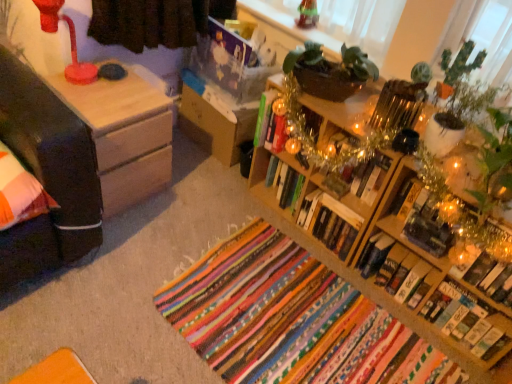
Question: Is multicolored woven rug at center wider than wooden bookshelf at right?

Choices:
 (A) yes
 (B) no

Answer: (A)

Question: From a real-world perspective, does multicolored woven rug at center stand above wooden bookshelf at right?

Choices:
 (A) yes
 (B) no

Answer: (B)

Question: From the image's perspective, is multicolored woven rug at center on top of wooden bookshelf at right?

Choices:
 (A) yes
 (B) no

Answer: (B)

Question: Is multicolored woven rug at center aimed at wooden bookshelf at right?

Choices:
 (A) yes
 (B) no

Answer: (B)

Question: Considering the relative sizes of multicolored woven rug at center and wooden bookshelf at right in the image provided, is multicolored woven rug at center shorter than wooden bookshelf at right?

Choices:
 (A) yes
 (B) no

Answer: (A)

Question: Considering the positions of multicolored woven rug at center and hardcover book at lower right, which appears as the sixth book when viewed from the left, in the image, is multicolored woven rug at center wider or thinner than hardcover book at lower right, which appears as the sixth book when viewed from the left,?

Choices:
 (A) thin
 (B) wide

Answer: (B)

Question: Based on their sizes in the image, would you say multicolored woven rug at center is bigger or smaller than hardcover book at lower right, which appears as the sixth book when viewed from the left?

Choices:
 (A) small
 (B) big

Answer: (B)

Question: From the image's perspective, is multicolored woven rug at center above or below hardcover book at lower right, placed as the second book when sorted from right to left?

Choices:
 (A) above
 (B) below

Answer: (B)

Question: Is multicolored woven rug at center spatially inside hardcover book at lower right, which appears as the sixth book when viewed from the left, or outside of it?

Choices:
 (A) inside
 (B) outside

Answer: (B)

Question: Relative to hardcover book at upper right, the third book in the right-to-left sequence, is hardcover book at center, which is the seventh book in left-to-right order, in front or behind?

Choices:
 (A) behind
 (B) front

Answer: (A)

Question: Does point [x=459, y=317] appear closer or farther from the camera than point [x=460, y=319]?

Choices:
 (A) farther
 (B) closer

Answer: (A)

Question: Considering the relative positions of hardcover book at center, which is the seventh book in left-to-right order, and hardcover book at upper right, the third book in the right-to-left sequence, in the image provided, is hardcover book at center, which is the seventh book in left-to-right order, to the left or to the right of hardcover book at upper right, the third book in the right-to-left sequence,?

Choices:
 (A) left
 (B) right

Answer: (B)

Question: Looking at their shapes, would you say hardcover book at center, positioned as the 1th book in right-to-left order, is wider or thinner than hardcover book at upper right, the third book in the right-to-left sequence?

Choices:
 (A) wide
 (B) thin

Answer: (B)

Question: In the image, is matte plastic lamp at upper left on the left side or the right side of hardcover book at center, marked as the first book in a left-to-right arrangement?

Choices:
 (A) left
 (B) right

Answer: (A)

Question: From a real-world perspective, is matte plastic lamp at upper left physically located above or below hardcover book at center, marked as the first book in a left-to-right arrangement?

Choices:
 (A) below
 (B) above

Answer: (B)